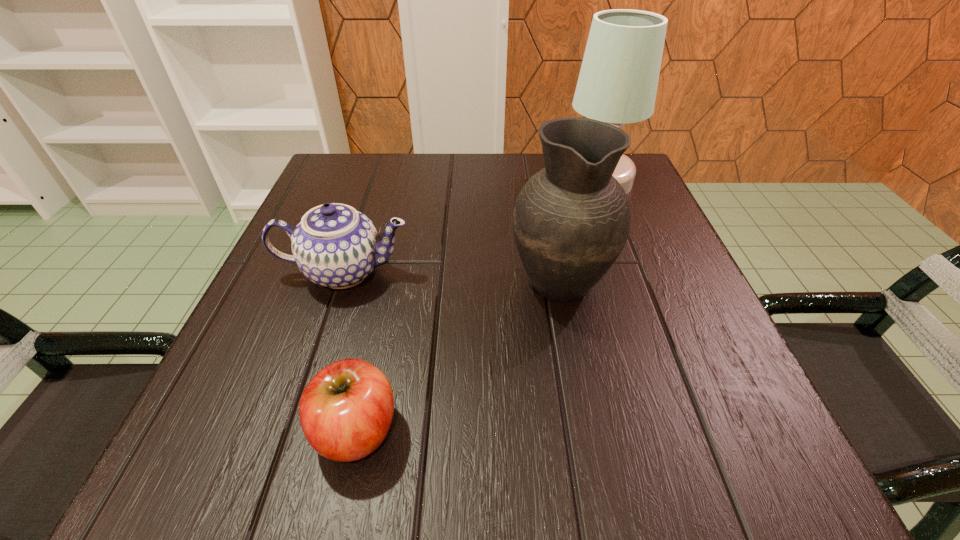
The image size is (960, 540). What are the coordinates of `vacant space that's between the second tallest object and the shortest object` in the screenshot? It's located at (458, 355).

Image resolution: width=960 pixels, height=540 pixels. I want to click on free spot between the third tallest object and the shortest object, so (350, 351).

At what (x,y) coordinates should I click in order to perform the action: click on vacant space in between the second shortest object and the nearest object. Please return your answer as a coordinate pair (x, y). Looking at the image, I should click on (350, 351).

At what (x,y) coordinates should I click in order to perform the action: click on empty space that is in between the chinaware and the farthest object. Please return your answer as a coordinate pair (x, y). The height and width of the screenshot is (540, 960). Looking at the image, I should click on (471, 226).

This screenshot has height=540, width=960. Find the location of `empty location between the shortest object and the farthest object`. empty location between the shortest object and the farthest object is located at coordinates (477, 306).

Where is `free space between the tallest object and the nearest object`? The image size is (960, 540). free space between the tallest object and the nearest object is located at coordinates (477, 306).

In order to click on free space between the tallest object and the third tallest object in this screenshot , I will do `click(471, 226)`.

Find the location of `vacant area that lies between the chinaware and the pitcher`. vacant area that lies between the chinaware and the pitcher is located at coordinates (452, 275).

Locate an element on the screen. The width and height of the screenshot is (960, 540). object identified as the third closest to the apple is located at coordinates (618, 80).

At what (x,y) coordinates should I click in order to perform the action: click on object that is the third closest one to the apple. Please return your answer as a coordinate pair (x, y). This screenshot has width=960, height=540. Looking at the image, I should click on (618, 80).